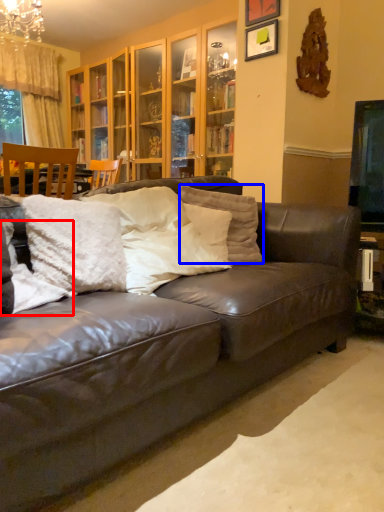
Question: Which point is closer to the camera, pillow (highlighted by a red box) or pillow (highlighted by a blue box)?

Choices:
 (A) pillow
 (B) pillow

Answer: (A)